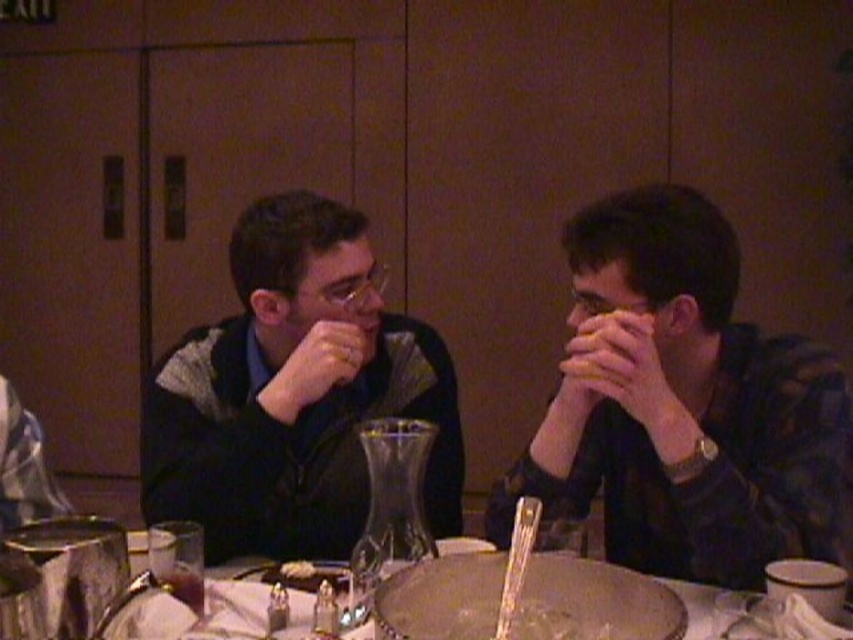
You are a photographer setting up for an event. You need to position a light to the left of the white glossy table at center. Will the light be to the right or left of the dark plaid shirt at center?

The dark plaid shirt at center is to the right of the white glossy table at center. Placing the light to the left of the white glossy table at center would mean the light is to the left of the dark plaid shirt at center as well.

You are taking a photo of the table setup in the dining scene. You want to focus on the point closer to the camera. Which point should you choose between point (831, 426) and point (299, 618)?

Point (831, 426) is further to the camera than point (299, 618), so you should choose point (831, 426) to focus on the point closer to the camera.

You are standing at the entrance of the room and want to locate the dark plaid shirt at center. According to the coordinates provided, where should you look relative to the center of the image?

The dark plaid shirt at center is located at coordinates point (685, 410), which is to the right and slightly above the center of the image.